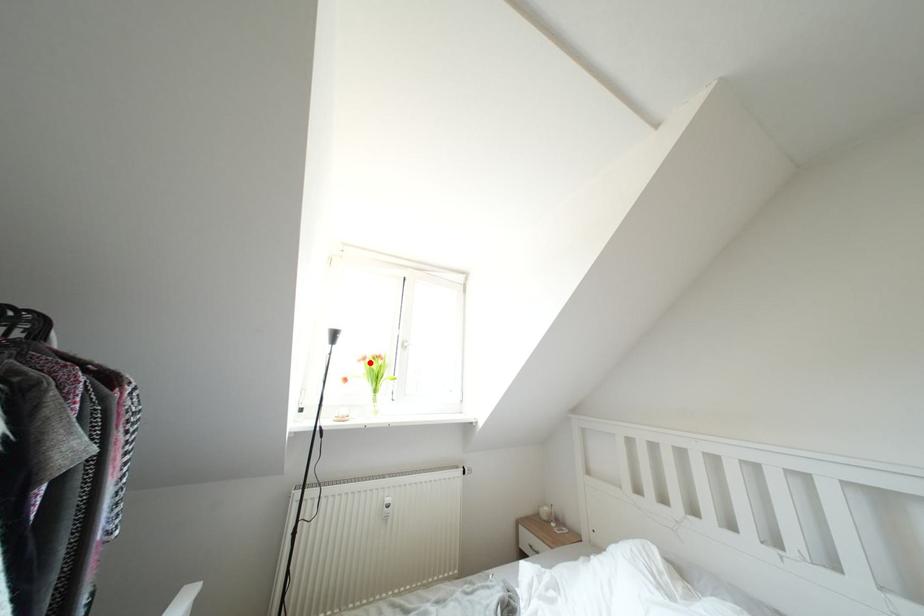
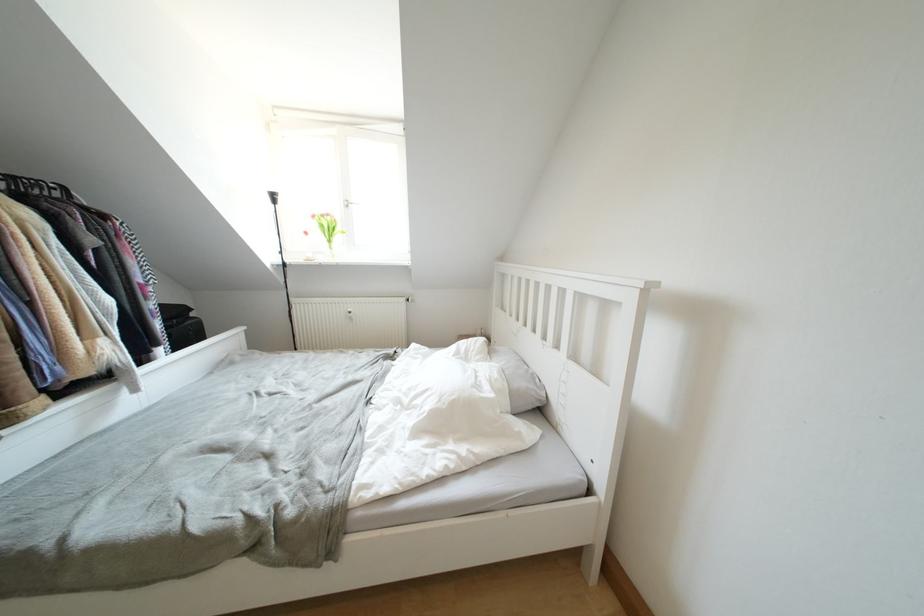
The point at the highlighted location is marked in the first image. Where is the corresponding point in the second image?

(319, 220)